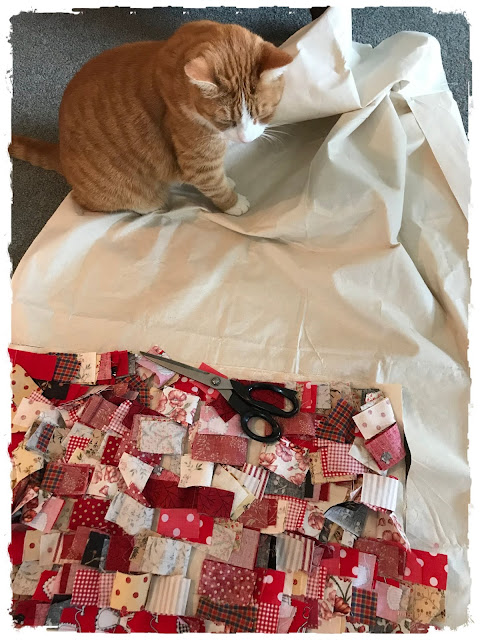
You are a GUI agent. You are given a task and a screenshot of the screen. Output one action in this format:
    pyautogui.click(x=<x>, y=<y>)
    Task: Click on the blue carpet
    Image resolution: width=480 pixels, height=640 pixels.
    Given the screenshot: What is the action you would take?
    pyautogui.click(x=130, y=20)